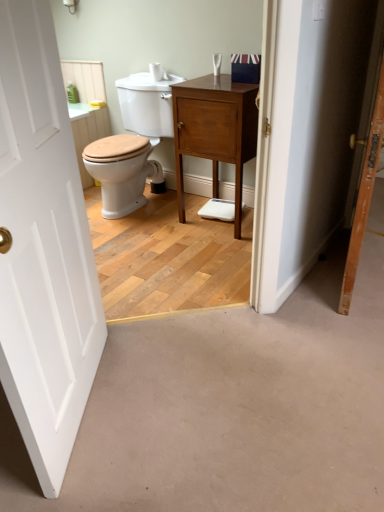
Question: Visually, is wooden door at right, the second door in the left-to-right sequence, positioned to the left or to the right of matte wood nightstand at center?

Choices:
 (A) left
 (B) right

Answer: (B)

Question: In terms of height, does wooden door at right, acting as the 1th door starting from the right, look taller or shorter compared to matte wood nightstand at center?

Choices:
 (A) tall
 (B) short

Answer: (A)

Question: Considering the real-world distances, which object is closest to the wooden door at right, acting as the 1th door starting from the right?

Choices:
 (A) white wooden door at left, which is counted as the second door, starting from the right
 (B) matte wood nightstand at center

Answer: (B)

Question: Estimate the real-world distances between objects in this image. Which object is farther from the white wooden door at left, which is counted as the second door, starting from the right?

Choices:
 (A) wooden door at right, the second door in the left-to-right sequence
 (B) matte wood nightstand at center

Answer: (B)